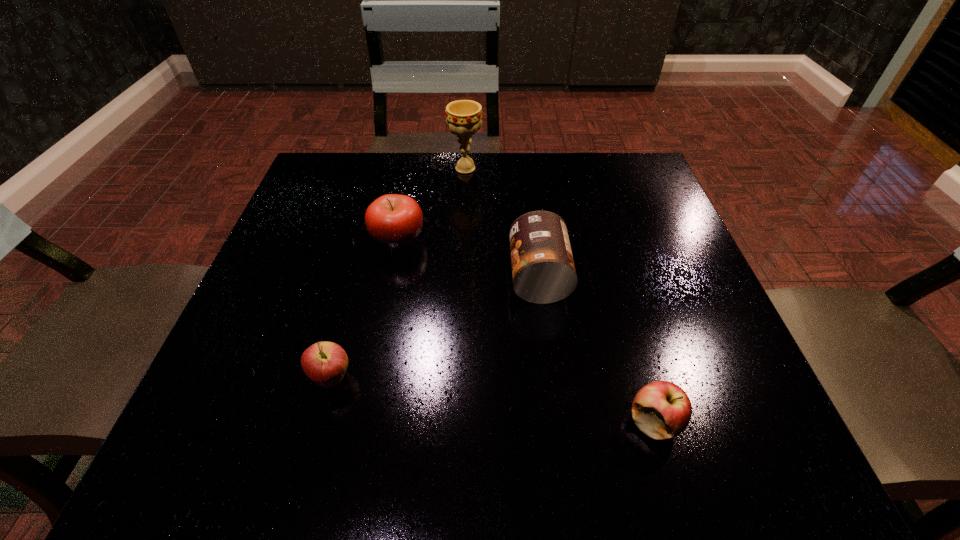
The height and width of the screenshot is (540, 960). I want to click on free space between the farthest apple and the nearest apple, so click(526, 330).

Where is `free space that is in between the second object from right to left and the farthest apple`? The image size is (960, 540). free space that is in between the second object from right to left and the farthest apple is located at coordinates (468, 258).

Identify the location of free space between the third object from right to left and the fourth farthest object. (398, 274).

Image resolution: width=960 pixels, height=540 pixels. Identify the location of free space between the rightmost apple and the second object from right to left. (596, 349).

Where is `vacant point located between the farthest apple and the rightmost object`? This screenshot has height=540, width=960. vacant point located between the farthest apple and the rightmost object is located at coordinates (526, 330).

Where is `unoccupied area between the second nearest apple and the farthest apple`? This screenshot has width=960, height=540. unoccupied area between the second nearest apple and the farthest apple is located at coordinates (365, 309).

The image size is (960, 540). Identify the location of object that ranks as the fourth closest to the third object from right to left. (662, 410).

Identify the location of object that can be found as the fourth closest to the second farthest apple. This screenshot has height=540, width=960. (463, 117).

Locate which apple is the second closest to the second nearest apple. Please provide its 2D coordinates. Your answer should be formatted as a tuple, i.e. [(x, y)], where the tuple contains the x and y coordinates of a point satisfying the conditions above.

[(662, 410)]

Choose which apple is the second nearest neighbor to the chalice. Please provide its 2D coordinates. Your answer should be formatted as a tuple, i.e. [(x, y)], where the tuple contains the x and y coordinates of a point satisfying the conditions above.

[(325, 363)]